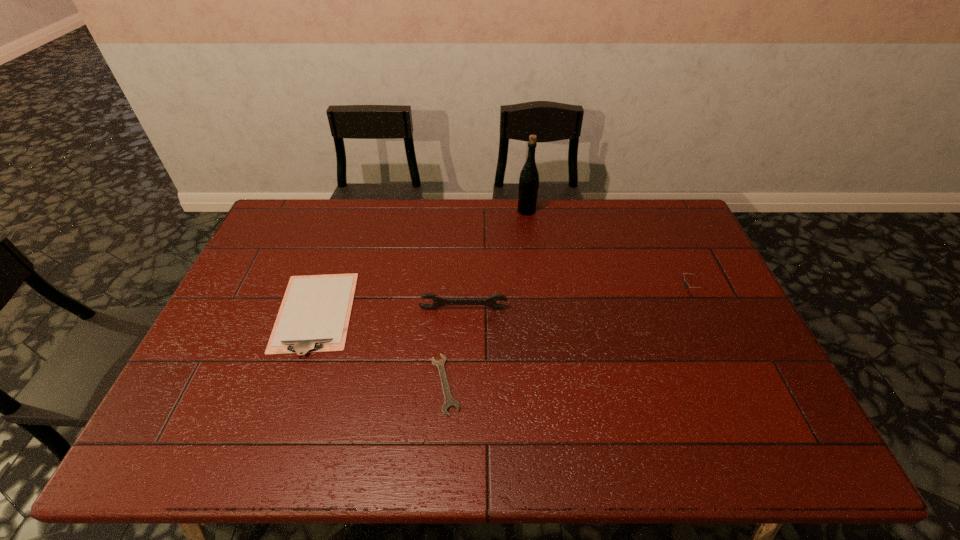
Image resolution: width=960 pixels, height=540 pixels. Find the location of `beer bottle`. beer bottle is located at coordinates (529, 177).

The height and width of the screenshot is (540, 960). I want to click on the tallest object, so click(529, 177).

Where is `the rightmost object`? This screenshot has height=540, width=960. the rightmost object is located at coordinates (686, 284).

Identify the location of the taller wrench. The width and height of the screenshot is (960, 540). (438, 301).

At what (x,y) coordinates should I click in order to perform the action: click on the fourth tallest object. Please return your answer as a coordinate pair (x, y). This screenshot has width=960, height=540. Looking at the image, I should click on (314, 316).

At what (x,y) coordinates should I click in order to perform the action: click on clipboard. Please return your answer as a coordinate pair (x, y). This screenshot has width=960, height=540. Looking at the image, I should click on coord(314,316).

Where is `the shortest object`? the shortest object is located at coordinates (449, 402).

Image resolution: width=960 pixels, height=540 pixels. In order to click on the nearer wrench in this screenshot , I will do `click(449, 402)`.

In order to click on vacant space located on the left of the beer bottle in this screenshot , I will do `click(433, 211)`.

This screenshot has width=960, height=540. I want to click on free space located in front of the lenses of the rightmost object, so click(x=563, y=293).